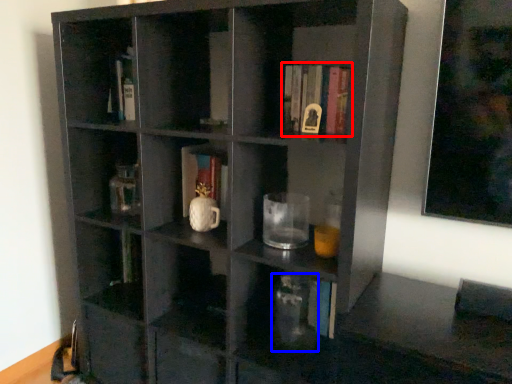
Question: Which object appears farthest to the camera in this image, book (highlighted by a red box) or glass vase (highlighted by a blue box)?

Choices:
 (A) book
 (B) glass vase

Answer: (B)